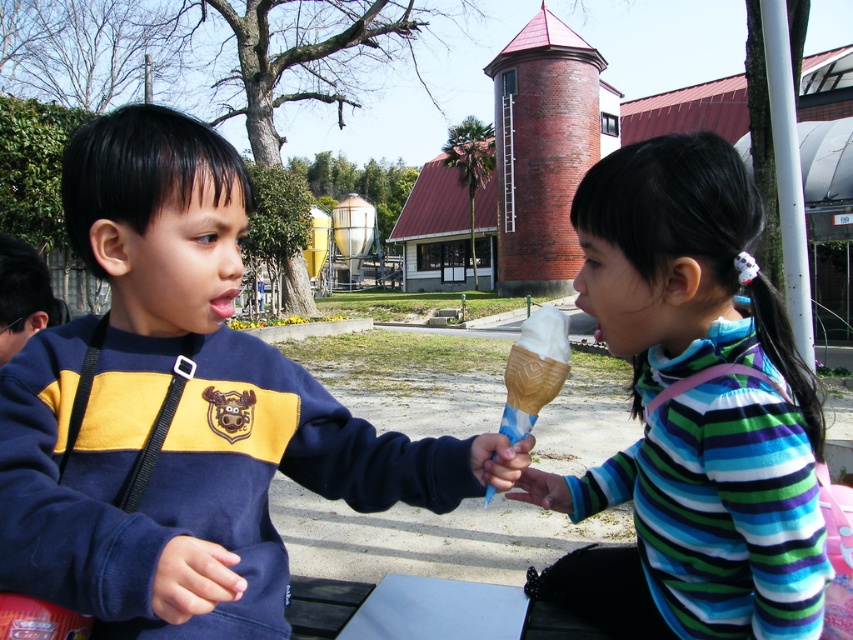
You are a photographer trying to capture a candid shot of the two children. You notice the matte blue sweatshirt at center and the vanilla ice cream in waffle cone at center. Which object should you focus on if you want to include both in your frame without moving your camera? Explain your reasoning based on their positions.

The matte blue sweatshirt at center is to the left of the vanilla ice cream in waffle cone at center. Since both objects are at the center, focusing on the center area will ensure both are included in the frame without needing to adjust the camera position.

You are a parent trying to decide which ice cream to give your child. The white matte ice cream cone at right and the vanilla ice cream in waffle cone at center are both available. Which one is taller?

The white matte ice cream cone at right is taller than the vanilla ice cream in waffle cone at center.